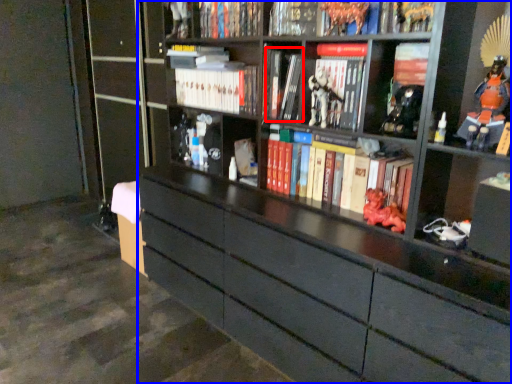
Question: Which point is closer to the camera, book (highlighted by a red box) or bookcase (highlighted by a blue box)?

Choices:
 (A) book
 (B) bookcase

Answer: (B)